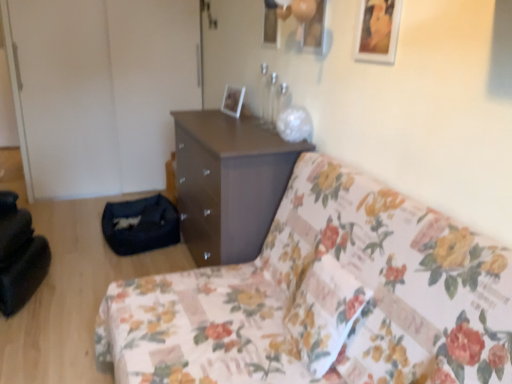
Question: Considering the positions of wooden picture frame at upper right, which appears as the first picture frame when viewed from the front, and white glossy picture frame at upper center, acting as the 2th picture frame starting from the front, in the image, is wooden picture frame at upper right, which appears as the first picture frame when viewed from the front, taller or shorter than white glossy picture frame at upper center, acting as the 2th picture frame starting from the front,?

Choices:
 (A) tall
 (B) short

Answer: (A)

Question: Is wooden picture frame at upper right, which appears as the first picture frame when viewed from the front, situated inside white glossy picture frame at upper center, which appears as the first picture frame when viewed from the left, or outside?

Choices:
 (A) inside
 (B) outside

Answer: (B)

Question: Which object is positioned farthest from the wooden picture frame at upper right, positioned as the 2th picture frame in left-to-right order?

Choices:
 (A) matte brown chest of drawers at center
 (B) floral fabric couch at center
 (C) white glossy picture frame at upper center, marked as the 2th picture frame in a right-to-left arrangement

Answer: (C)

Question: Which of these objects is positioned farthest from the matte brown chest of drawers at center?

Choices:
 (A) floral fabric couch at center
 (B) white glossy picture frame at upper center, acting as the 2th picture frame starting from the front
 (C) wooden picture frame at upper right, the 2th picture frame from the back

Answer: (C)